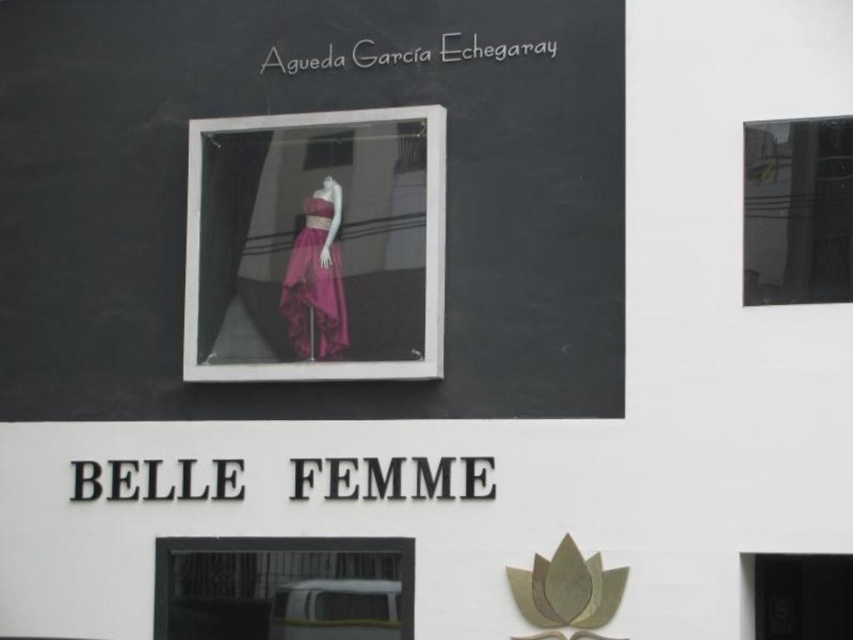
You are a delivery driver who needs to unload a package from your white plastic van at lower center and place it near the purple satin dress at center. Can you do this without moving the van?

The white plastic van at lower center is located below the purple satin dress at center, so you can easily unload the package from the van and place it near the dress without needing to move the van.

You are a delivery driver who just arrived at the store and need to park your white plastic van at lower center. The store has a loading zone marked on the right side of the pink satin dress at center. Can you park your van in the loading zone?

The pink satin dress at center is to the right of the white plastic van at lower center. Since the loading zone is on the right side of the pink satin dress at center, the van cannot be parked there as it would be positioned to the left of the dress, opposite the loading zone.

You are a fashion designer visiting the store and notice two dresses displayed in the window. The pink satin dress at center and the purple satin dress at center. Which one takes up more space in the display?

The purple satin dress at center takes up more space than the pink satin dress at center because the pink satin dress at center occupies less space than the purple satin dress at center.